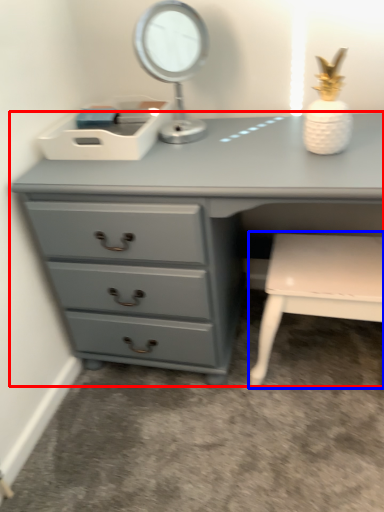
Question: Which of the following is the closest to the observer, chest of drawers (highlighted by a red box) or chair (highlighted by a blue box)?

Choices:
 (A) chest of drawers
 (B) chair

Answer: (A)